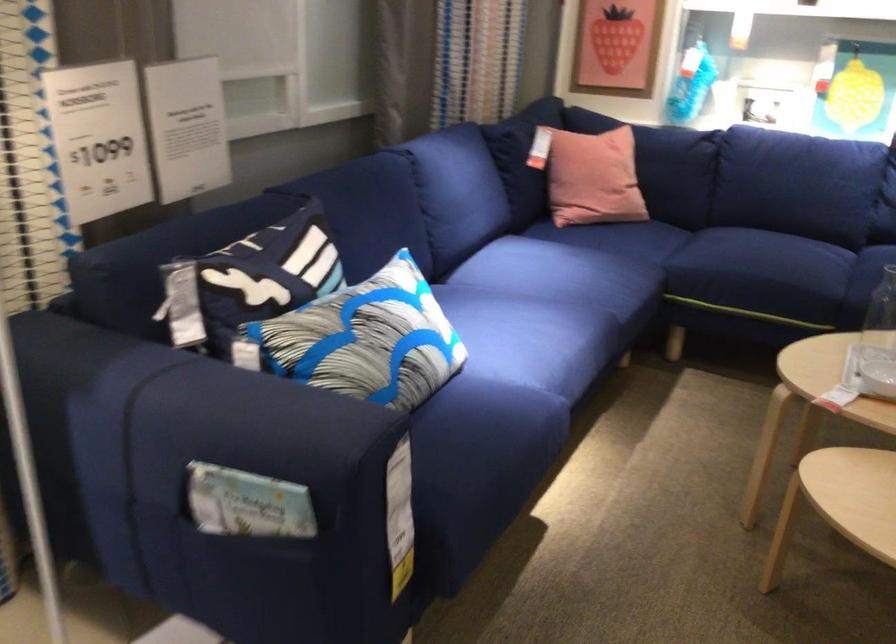
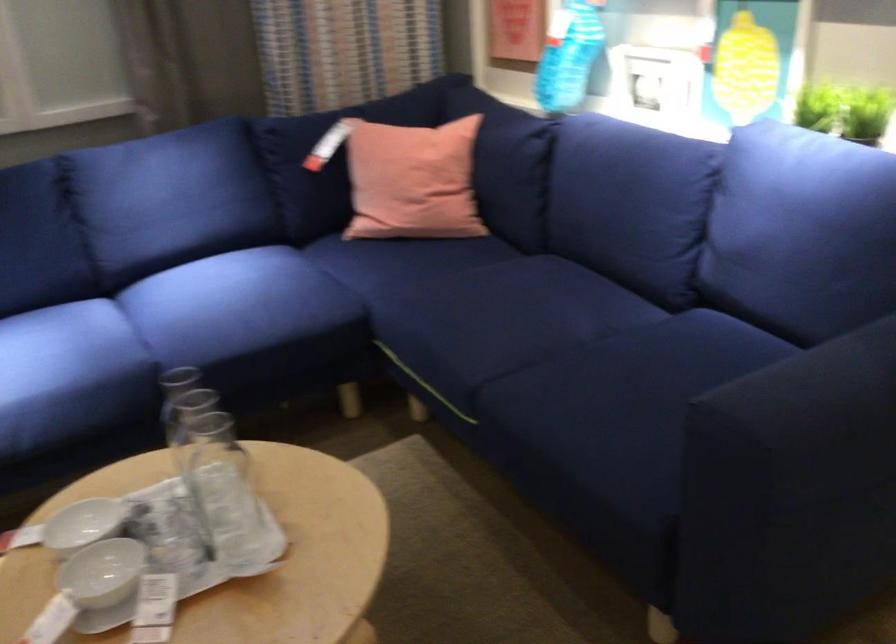
In the second image, find the point that corresponds to (618,169) in the first image.

(412, 181)